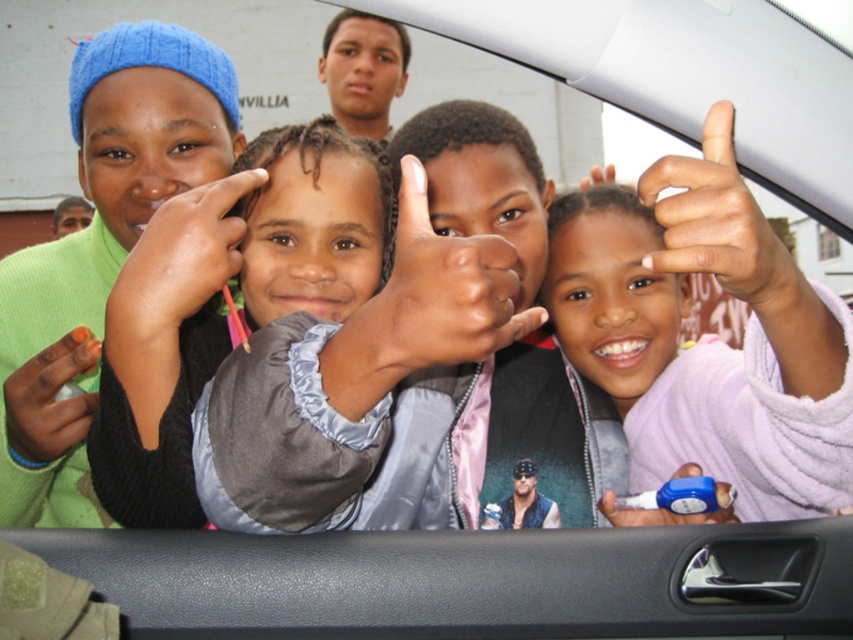
You are a photographer trying to capture a clear photo of the blue rubber band at lower right. However, the matte gray hand at center is blocking your view. Can you adjust your position to take the photo without moving the objects?

The blue rubber band at lower right is behind the matte gray hand at center, so you can move your camera position to the side or lower to see around the matte gray hand at center and capture the blue rubber band at lower right without moving the objects.